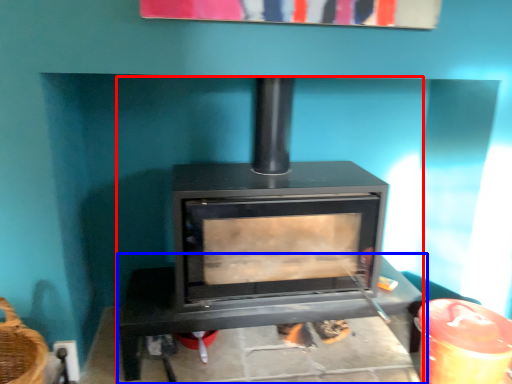
Question: Which point is closer to the camera, wood burning stove (highlighted by a red box) or furniture (highlighted by a blue box)?

Choices:
 (A) wood burning stove
 (B) furniture

Answer: (A)